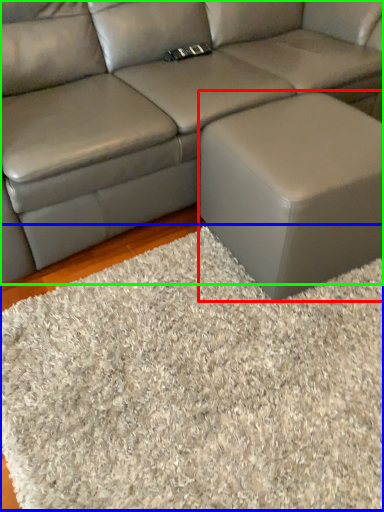
Question: Considering the real-world distances, which object is closest to stool (highlighted by a red box)? mat (highlighted by a blue box) or studio couch (highlighted by a green box).

Choices:
 (A) mat
 (B) studio couch

Answer: (A)